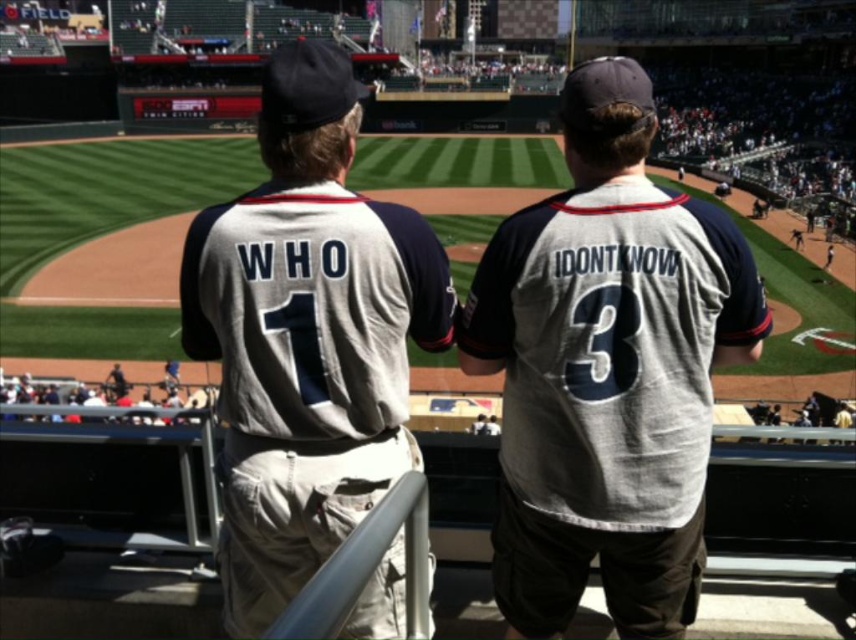
Question: Is gray cotton jersey at center further to camera compared to matte gray jersey at center?

Choices:
 (A) yes
 (B) no

Answer: (B)

Question: Which object appears closest to the camera in this image?

Choices:
 (A) gray jersey at center
 (B) gray cotton jersey at center
 (C) matte gray jersey at center

Answer: (B)

Question: Can you confirm if gray cotton jersey at center is bigger than matte gray jersey at center?

Choices:
 (A) no
 (B) yes

Answer: (B)

Question: Which point is closer to the camera?

Choices:
 (A) (599, 294)
 (B) (123, 381)
 (C) (346, 632)

Answer: (C)

Question: Which point is closer to the camera?

Choices:
 (A) (706, 262)
 (B) (250, 198)

Answer: (A)

Question: Can you confirm if gray jersey at center is bigger than matte gray jersey at center?

Choices:
 (A) no
 (B) yes

Answer: (B)